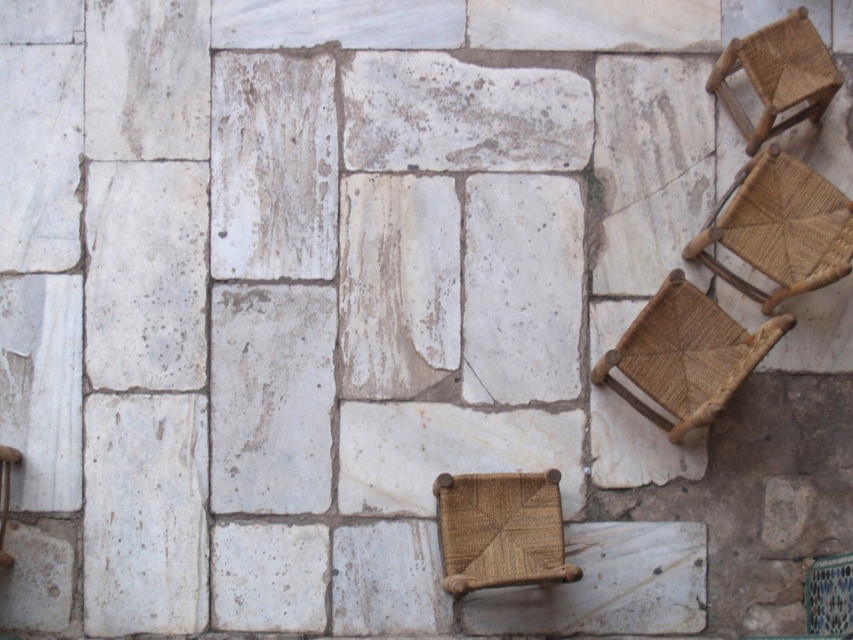
You are standing at the center of the stone floor and want to move towards the brown woven chair at lower right. According to the coordinates provided, in which direction should you walk?

The brown woven chair at lower right is located at coordinates point (685,355). Since you are at the center, you should walk towards the lower right direction to reach it.